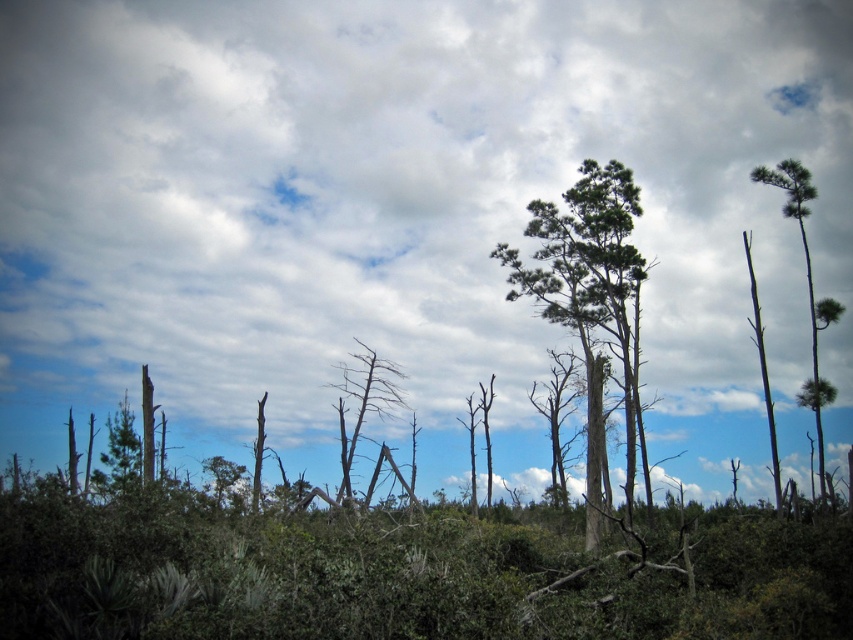
You are an environmental scientist assessing the landscape. You observe the cloudy sky at upper center and the bare wood tree at center. Which object occupies a larger area in the image?

The cloudy sky at upper center has a greater width than the bare wood tree at center, so it occupies a larger area in the image.

You are an environmental scientist analyzing the landscape. You notice the cloudy sky at upper center and the bare wood tree at center. Which object is located to the right of the other?

The cloudy sky at upper center is positioned on the right side of the bare wood tree at center, so the cloudy sky at upper center is to the right of the bare wood tree at center.

You are an environmental scientist analyzing the landscape. You observe the cloudy sky at upper center and the green textured pine tree at upper right. Which of these two elements occupies a larger vertical space in the scene?

Answer: The cloudy sky at upper center is much taller than the green textured pine tree at upper right, so it occupies a larger vertical space in the scene.